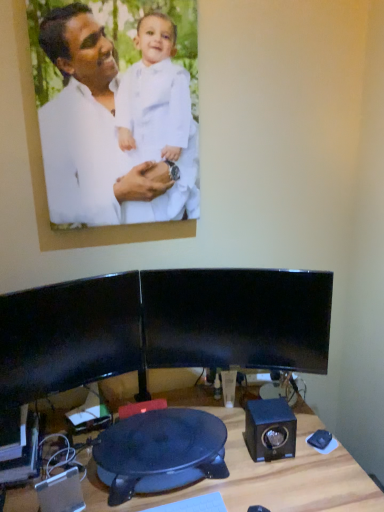
Question: Should I look upward or downward to see black plastic swivel chair at center?

Choices:
 (A) down
 (B) up

Answer: (A)

Question: Is blue matte speaker at lower right, which appears as the 1th speaker when viewed from the right, oriented towards black plastic swivel chair at center?

Choices:
 (A) no
 (B) yes

Answer: (A)

Question: From the image's perspective, is blue matte speaker at lower right, which appears as the 1th speaker when viewed from the right, under black plastic swivel chair at center?

Choices:
 (A) no
 (B) yes

Answer: (A)

Question: Is blue matte speaker at lower right, which appears as the 2th speaker when viewed from the front, touching black plastic swivel chair at center?

Choices:
 (A) no
 (B) yes

Answer: (A)

Question: Considering the relative sizes of blue matte speaker at lower right, which ranks as the second speaker in left-to-right order, and black plastic swivel chair at center in the image provided, is blue matte speaker at lower right, which ranks as the second speaker in left-to-right order, wider than black plastic swivel chair at center?

Choices:
 (A) yes
 (B) no

Answer: (B)

Question: Does blue matte speaker at lower right, which appears as the 1th speaker when viewed from the right, come behind black plastic swivel chair at center?

Choices:
 (A) yes
 (B) no

Answer: (A)

Question: From the image's perspective, is blue matte speaker at lower right, which appears as the 2th speaker when viewed from the front, on top of black plastic swivel chair at center?

Choices:
 (A) no
 (B) yes

Answer: (B)

Question: Does black glossy monitor at center, acting as the 2th computer monitor starting from the right, have a greater width compared to black plastic swivel chair at center?

Choices:
 (A) no
 (B) yes

Answer: (A)

Question: Considering the relative positions of black glossy monitor at center, acting as the 2th computer monitor starting from the right, and black plastic swivel chair at center in the image provided, is black glossy monitor at center, acting as the 2th computer monitor starting from the right, behind black plastic swivel chair at center?

Choices:
 (A) no
 (B) yes

Answer: (B)

Question: Is the depth of black glossy monitor at center, acting as the 2th computer monitor starting from the right, less than that of black plastic swivel chair at center?

Choices:
 (A) yes
 (B) no

Answer: (B)

Question: Is black glossy monitor at center, acting as the 2th computer monitor starting from the right, next to black plastic swivel chair at center and touching it?

Choices:
 (A) no
 (B) yes

Answer: (A)

Question: From the image's perspective, would you say black glossy monitor at center, acting as the 2th computer monitor starting from the right, is shown under black plastic swivel chair at center?

Choices:
 (A) no
 (B) yes

Answer: (A)

Question: Is black plastic swivel chair at center at the back of black glossy monitor at center, acting as the 2th computer monitor starting from the right?

Choices:
 (A) no
 (B) yes

Answer: (A)

Question: Considering the relative positions of black plastic speaker at lower left, which is counted as the second speaker, starting from the right, and black plastic swivel chair at center in the image provided, is black plastic speaker at lower left, which is counted as the second speaker, starting from the right, to the left of black plastic swivel chair at center from the viewer's perspective?

Choices:
 (A) yes
 (B) no

Answer: (A)